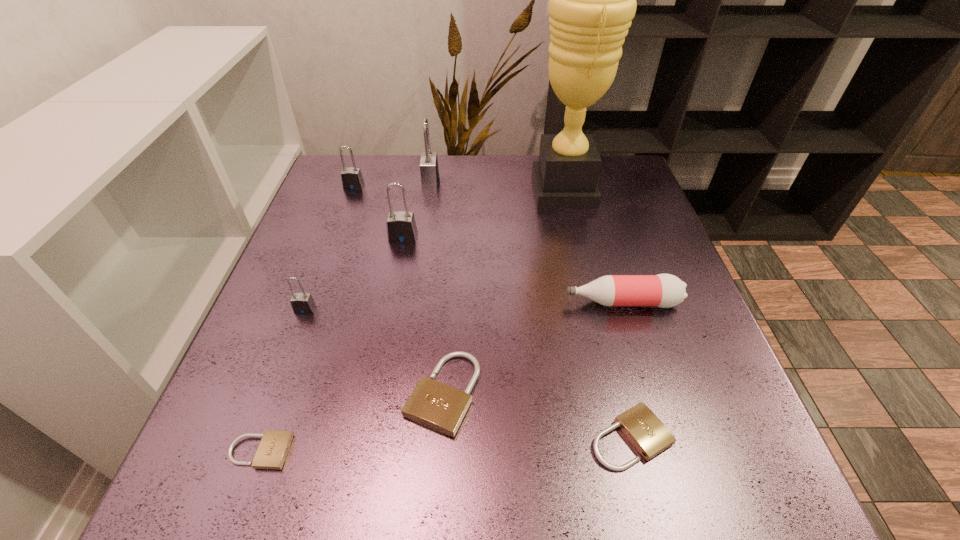
Image resolution: width=960 pixels, height=540 pixels. In order to click on vacant area between the tallest padlock and the rightmost beige padlock in this screenshot , I will do `click(531, 310)`.

Find the location of a particular element. This screenshot has height=540, width=960. free spot between the fourth shortest padlock and the second beige padlock from left to right is located at coordinates (374, 352).

Locate an element on the screen. This screenshot has height=540, width=960. vacant area that lies between the shortest padlock and the pink bottle is located at coordinates (441, 377).

Where is `empty location between the third shortest object and the rightmost beige padlock`? This screenshot has height=540, width=960. empty location between the third shortest object and the rightmost beige padlock is located at coordinates (537, 415).

Find the location of a particular element. This screenshot has height=540, width=960. unoccupied position between the biggest gray padlock and the leftmost beige padlock is located at coordinates (345, 317).

Select which object appears as the fourth closest to the sixth tallest padlock. Please provide its 2D coordinates. Your answer should be formatted as a tuple, i.e. [(x, y)], where the tuple contains the x and y coordinates of a point satisfying the conditions above.

[(592, 0)]

Where is `the seventh closest object to the fifth tallest padlock`? the seventh closest object to the fifth tallest padlock is located at coordinates (429, 170).

This screenshot has width=960, height=540. What are the coordinates of `padlock identified as the closest to the second nearest gray padlock` in the screenshot? It's located at (429, 170).

Identify which padlock is the sixth nearest to the tallest padlock. Please provide its 2D coordinates. Your answer should be formatted as a tuple, i.e. [(x, y)], where the tuple contains the x and y coordinates of a point satisfying the conditions above.

[(646, 432)]

At what (x,y) coordinates should I click in order to perform the action: click on the third closest gray padlock to the sixth tallest padlock. Please return your answer as a coordinate pair (x, y). This screenshot has height=540, width=960. Looking at the image, I should click on pos(429,170).